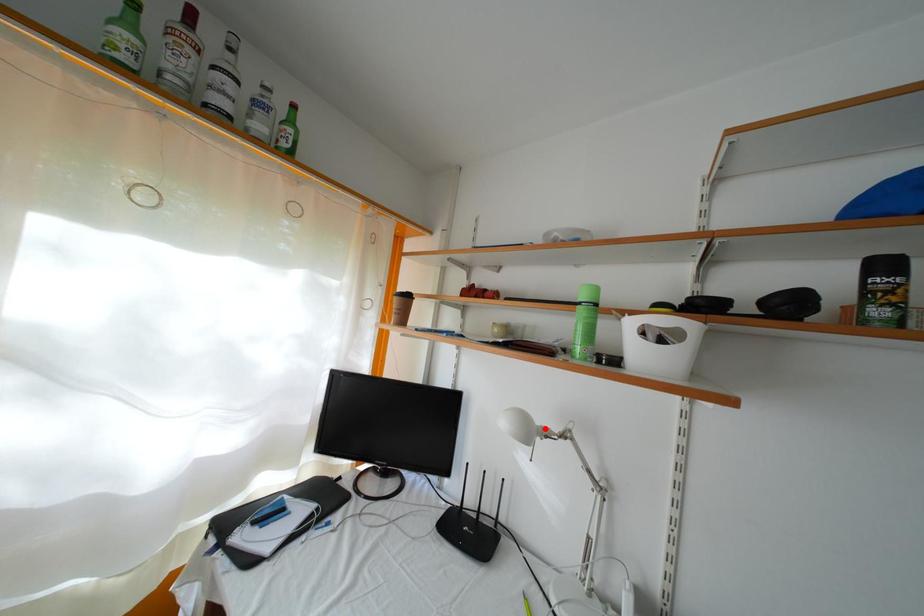
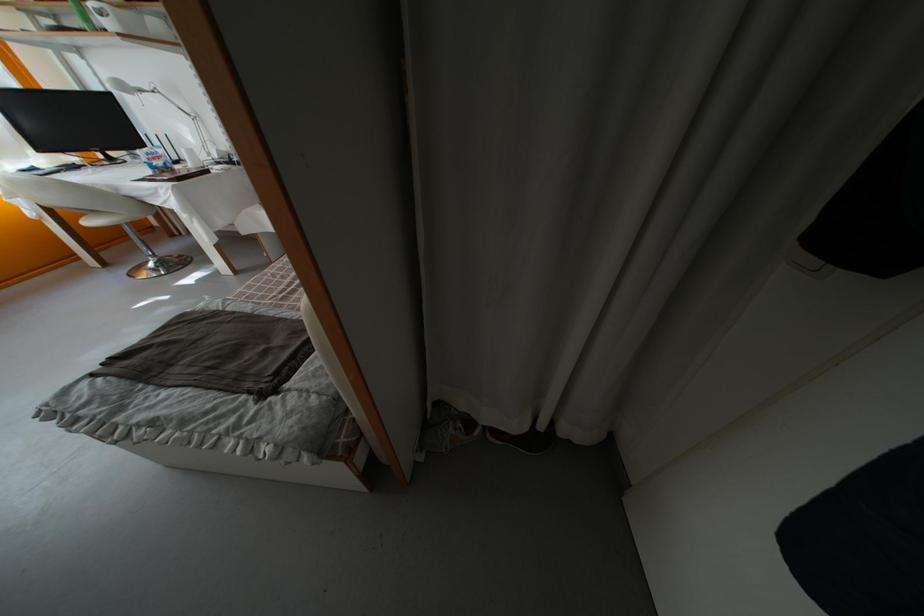
Find the pixel in the second image that matches the highlighted location in the first image.

(139, 91)